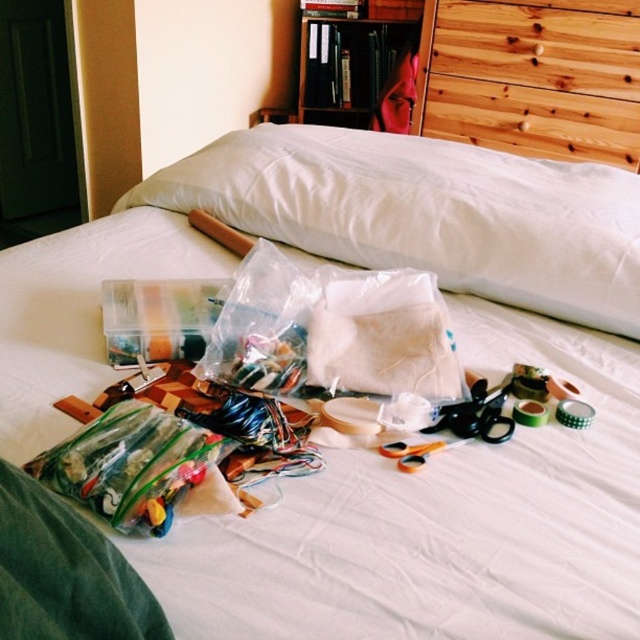
Does wooden at upper right appear on the left side of wooden bookshelf at upper center?

Incorrect, wooden at upper right is not on the left side of wooden bookshelf at upper center.

The image size is (640, 640). Describe the element at coordinates (532, 77) in the screenshot. I see `wooden at upper right` at that location.

Identify the location of wooden at upper right. Image resolution: width=640 pixels, height=640 pixels. (532, 77).

Is point (152, 513) closer to viewer compared to point (413, 68)?

That is True.

Is point (156, 522) behind point (419, 12)?

No, it is not.

What do you see at coordinates (131, 465) in the screenshot? I see `translucent plastic bag at center` at bounding box center [131, 465].

Image resolution: width=640 pixels, height=640 pixels. What are the coordinates of `translucent plastic bag at center` in the screenshot? It's located at (131, 465).

Between wooden at upper right and translucent plastic bag at center, which one has more height?

With more height is wooden at upper right.

Identify the location of wooden at upper right. (532, 77).